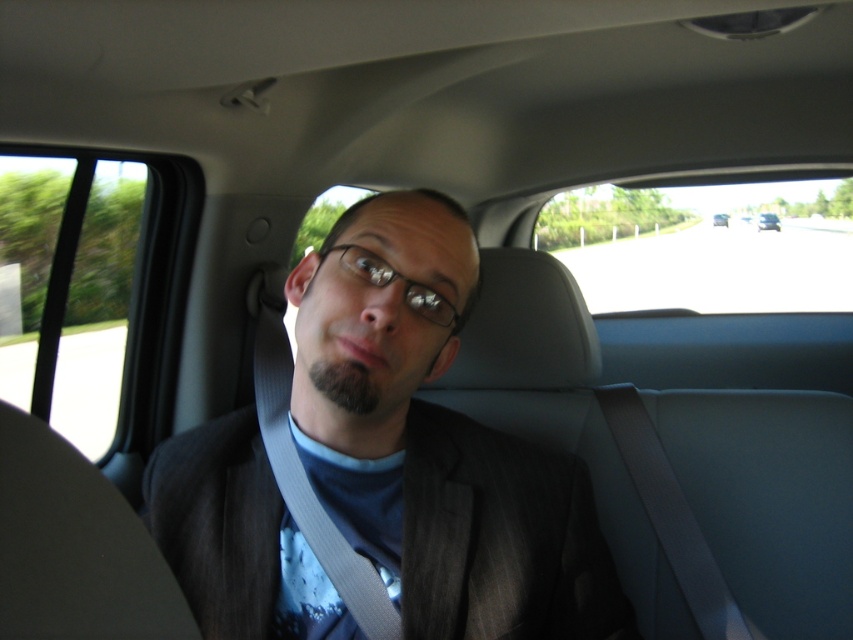
Question: Which point appears closest to the camera in this image?

Choices:
 (A) (761, 228)
 (B) (369, 273)
 (C) (438, 196)
 (D) (715, 220)

Answer: (B)

Question: Does black plastic glasses at center have a larger size compared to metallic silver sedan at center?

Choices:
 (A) no
 (B) yes

Answer: (A)

Question: Which point appears closest to the camera in this image?

Choices:
 (A) (761, 225)
 (B) (714, 224)

Answer: (A)

Question: Which of the following is the farthest from the observer?

Choices:
 (A) pyautogui.click(x=767, y=216)
 (B) pyautogui.click(x=289, y=566)
 (C) pyautogui.click(x=444, y=298)
 (D) pyautogui.click(x=726, y=224)

Answer: (D)

Question: Does dark gray suit at center have a larger size compared to black plastic glasses at center?

Choices:
 (A) no
 (B) yes

Answer: (B)

Question: Can you confirm if dark gray suit at center is smaller than metallic silver car at center?

Choices:
 (A) no
 (B) yes

Answer: (A)